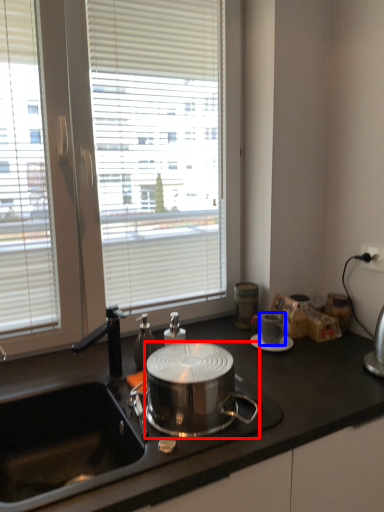
Question: Which object is closer to the camera taking this photo, kitchen appliance (highlighted by a red box) or coffee cup (highlighted by a blue box)?

Choices:
 (A) kitchen appliance
 (B) coffee cup

Answer: (A)